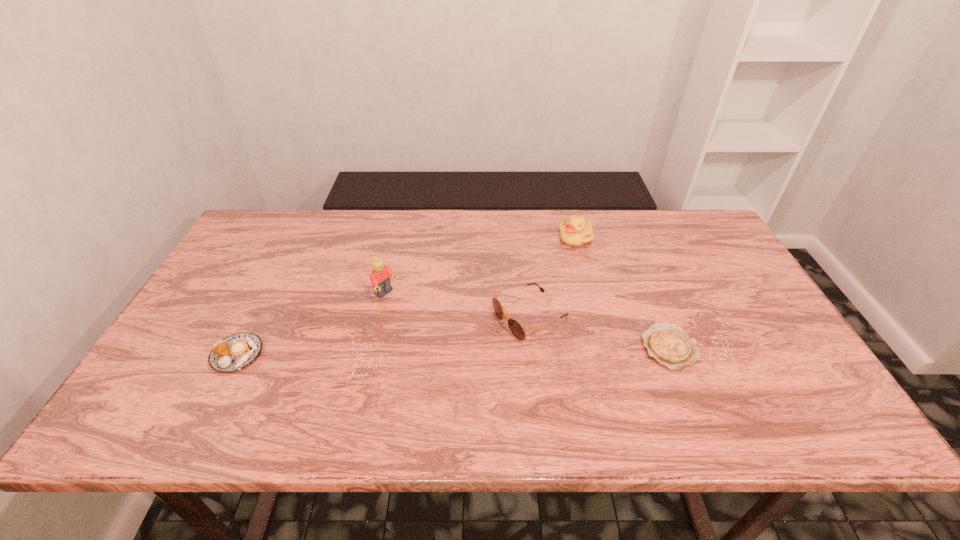
What are the coordinates of `free space between the Lego and the rightmost object` in the screenshot? It's located at (528, 321).

This screenshot has width=960, height=540. I want to click on vacant region between the leftmost object and the third tallest object, so click(384, 336).

Locate an element on the screen. free space that is in between the farthest object and the Lego is located at coordinates (481, 266).

Select which object appears as the second closest to the fourth object from right to left. Please provide its 2D coordinates. Your answer should be formatted as a tuple, i.e. [(x, y)], where the tuple contains the x and y coordinates of a point satisfying the conditions above.

[(237, 351)]

Locate an element on the screen. object that stands as the fourth closest to the farthest object is located at coordinates (237, 351).

Locate an element on the screen. free spot that satisfies the following two spatial constraints: 1. on the back side of the tallest object; 2. on the left side of the second object from right to left is located at coordinates (399, 238).

Locate an element on the screen. The width and height of the screenshot is (960, 540). free location that satisfies the following two spatial constraints: 1. on the front side of the third shortest object; 2. on the right side of the tallest object is located at coordinates (382, 316).

Locate an element on the screen. This screenshot has height=540, width=960. vacant area in the image that satisfies the following two spatial constraints: 1. on the front side of the fourth object from right to left; 2. on the right side of the third object from left to right is located at coordinates (382, 316).